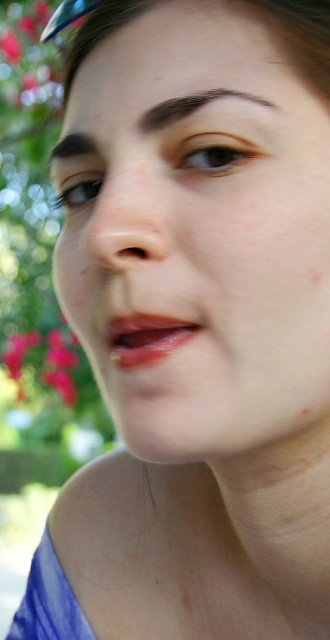
You are a photographer adjusting your camera to focus on the smooth skin face at center and the bright pink petals at lower left. Which object should you adjust your focus to first if you want to capture both in the same frame without moving the camera?

The smooth skin face at center should be focused on first since it is above the bright pink petals at lower left, so adjusting focus starting from the higher positioned object would ensure both are in frame without moving the camera.

You are a photographer adjusting your focus on a camera. You have two points in the image, point (x=128, y=172) and point (x=60, y=384). Which point should you focus on to ensure it appears sharp in the final photo?

Point (x=128, y=172) is closer to the camera than point (x=60, y=384), so focusing on point (x=128, y=172) will ensure it appears sharp in the final photo.

You are a photographer adjusting the camera to focus on the smooth skin face at center and the bright pink petals at lower left. Which object should you zoom in on to make it appear wider in the frame?

The bright pink petals at lower left should be zoomed in on because they are wider than the smooth skin face at center.